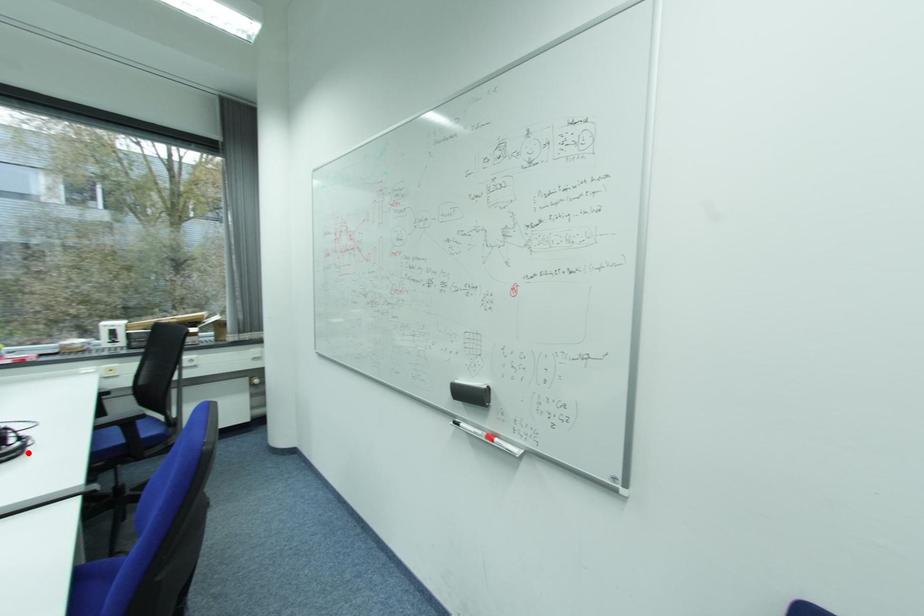
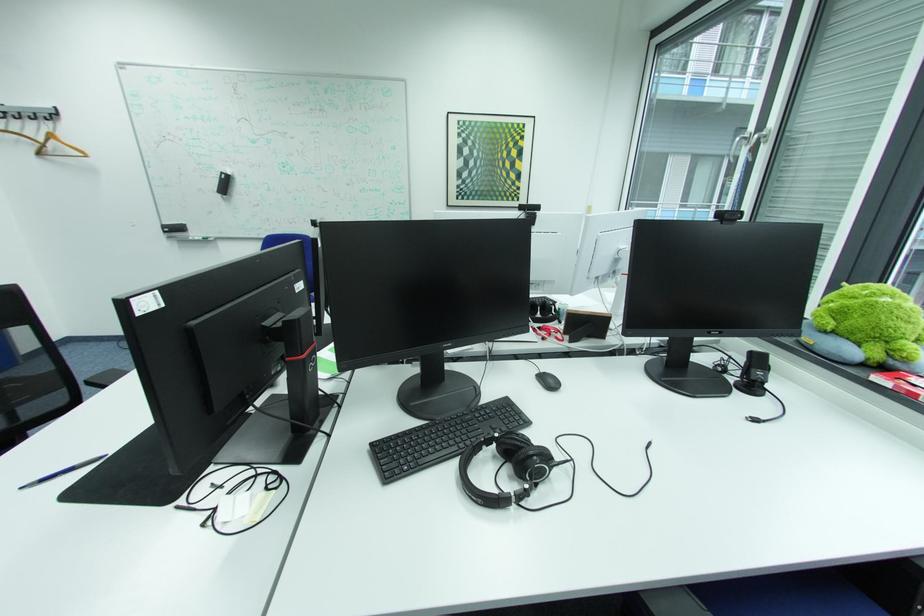
In the second image, find the point that corresponds to the highlighted location in the first image.

(489, 501)